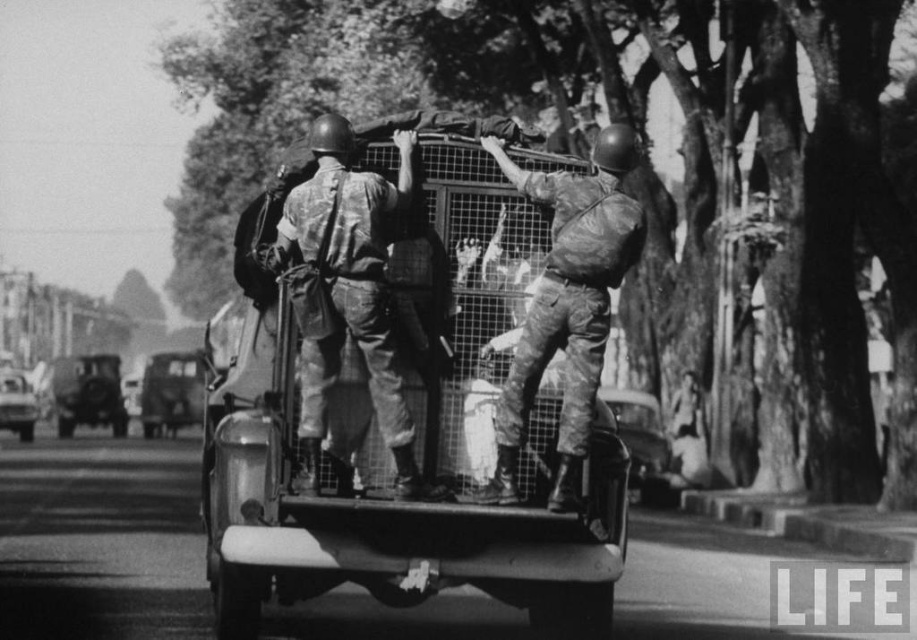
Is camouflage fabric uniform at center shorter than camouflage fabric soldier at center?

Incorrect, camouflage fabric uniform at center's height does not fall short of camouflage fabric soldier at center's.

I want to click on camouflage fabric uniform at center, so click(x=346, y=291).